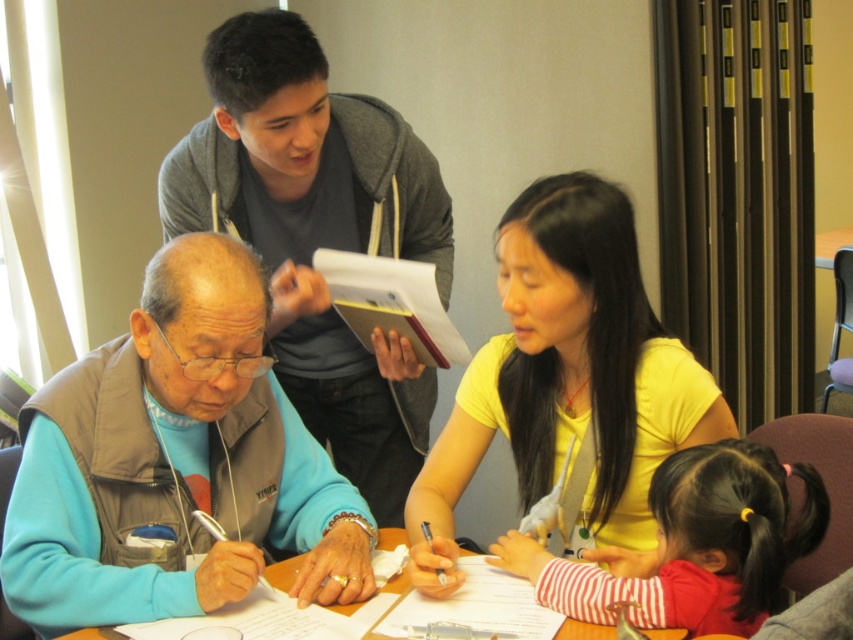
You are organizing a photo shoot and need to place two props on a shelf. The gray hoodie at upper center and the yellow matte shirt at center must be positioned such that they don not overlap. Given their sizes, which one should you place on the left to ensure there is enough space for both?

The gray hoodie at upper center is wider than the yellow matte shirt at center, so placing the wider gray hoodie at upper center on the left would allow sufficient space for both items without overlapping.

You are standing in front of the table where the older man is writing. You want to place a small object on the table. If you aim for point 1 at point (264, 385) and point 2 at point (635, 294), which point is closer to you?

Point 1 at point (264, 385) is closer to you since it is further to the camera than point 2 at point (635, 294).